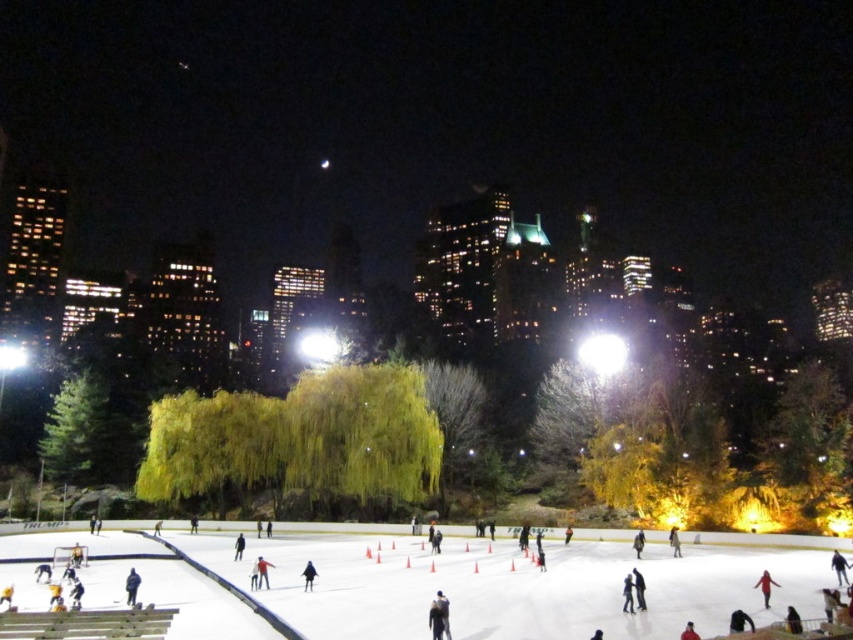
Does blue fabric jacket at center have a smaller size compared to black matte jacket at center?

Incorrect, blue fabric jacket at center is not smaller in size than black matte jacket at center.

You are a GUI agent. You are given a task and a screenshot of the screen. Output one action in this format:
    pyautogui.click(x=<x>, y=<y>)
    Task: Click on the blue fabric jacket at center
    
    Given the screenshot: What is the action you would take?
    pyautogui.click(x=131, y=586)

Does black matte jacket at center lie in front of red fabric jacket at center?

That is False.

Who is positioned more to the right, black matte jacket at center or red fabric jacket at center?

red fabric jacket at center is more to the right.

Does point (303, 586) come in front of point (698, 637)?

That is False.

Locate an element on the screen. Image resolution: width=853 pixels, height=640 pixels. black matte jacket at center is located at coordinates (308, 576).

This screenshot has height=640, width=853. Describe the element at coordinates (674, 541) in the screenshot. I see `light brown leather jacket at center` at that location.

Does light brown leather jacket at center have a smaller size compared to dark blue fabric at center?

Indeed, light brown leather jacket at center has a smaller size compared to dark blue fabric at center.

Measure the distance between point (675, 547) and camera.

46.78 meters

This screenshot has width=853, height=640. Identify the location of light brown leather jacket at center. (674, 541).